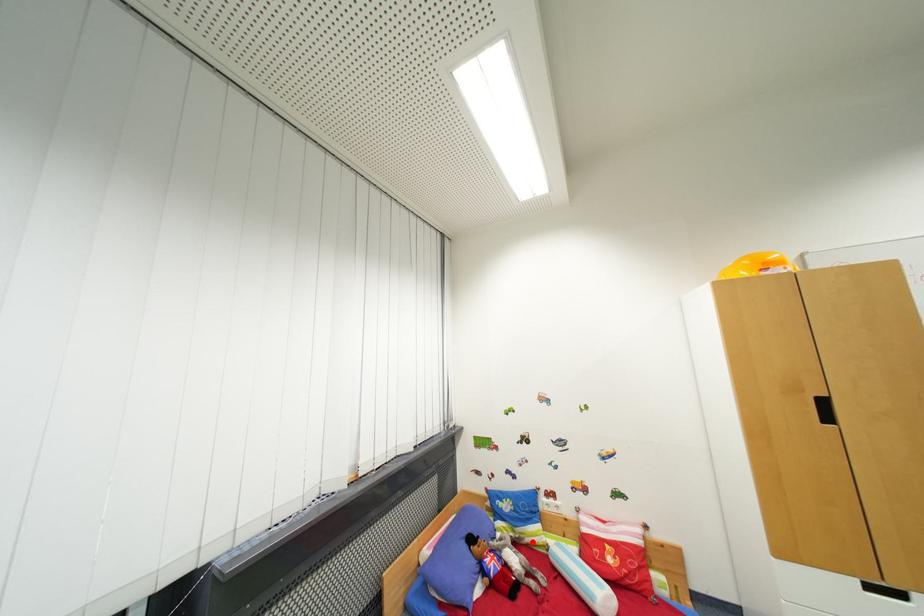
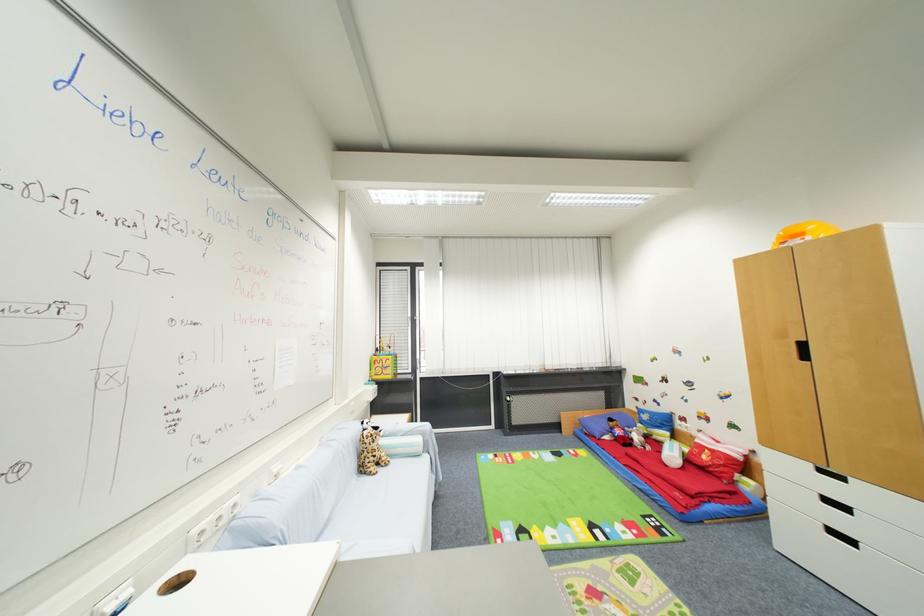
Question: I am providing you with two images of the same scene from different viewpoints. In image1, a red point is highlighted. Considering the same 3D point in image2, which of the following is correct?

Choices:
 (A) It is closer
 (B) It is farther

Answer: (A)